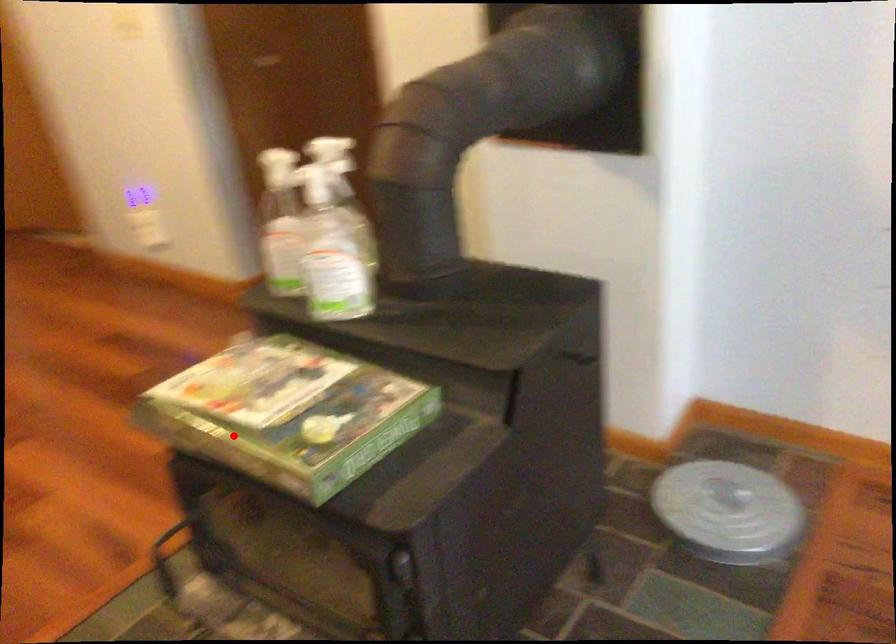
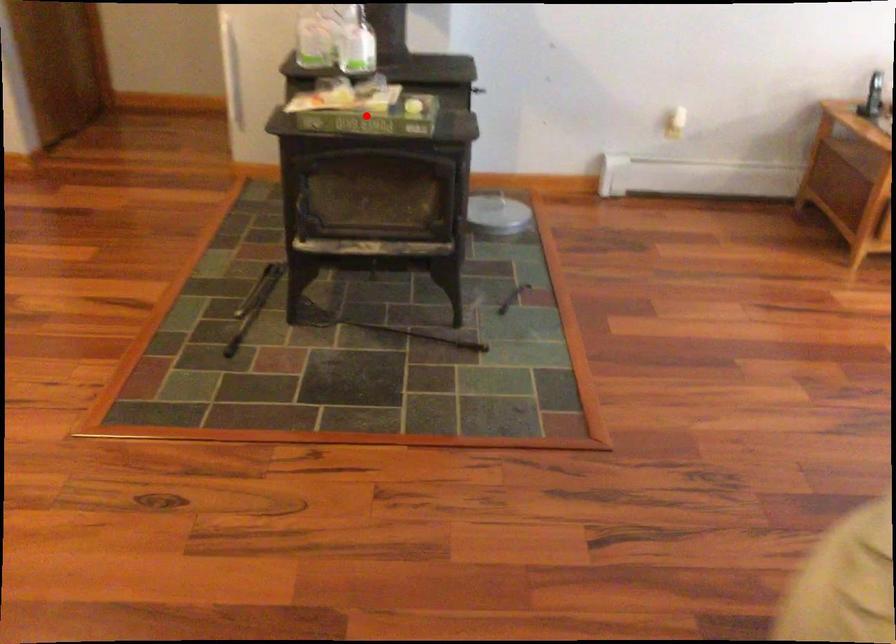
I am providing you with two images of the same scene from different viewpoints. A red point is marked on the first image and another point is marked on the second image. Are the points marked in image1 and image2 representing the same 3D position?

Yes